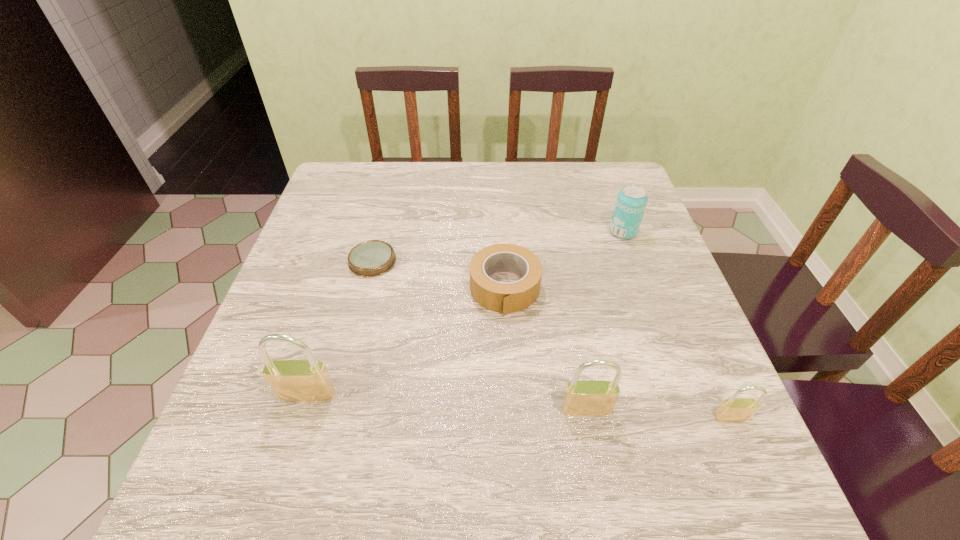
Please point a location where one more padlock can be added evenly. Please provide its 2D coordinates. Your answer should be formatted as a tuple, i.e. [(x, y)], where the tuple contains the x and y coordinates of a point satisfying the conditions above.

[(444, 402)]